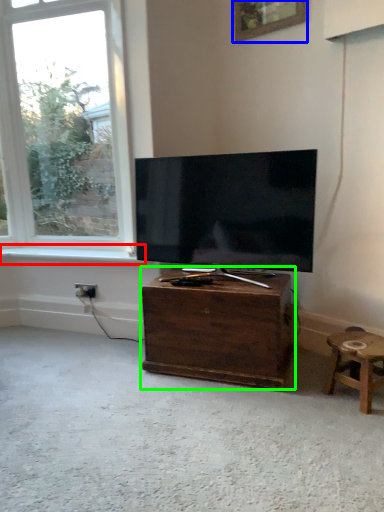
Question: Which object is the farthest from window sill (highlighted by a red box)? Choose among these: picture frame (highlighted by a blue box) or nightstand (highlighted by a green box).

Choices:
 (A) picture frame
 (B) nightstand

Answer: (A)